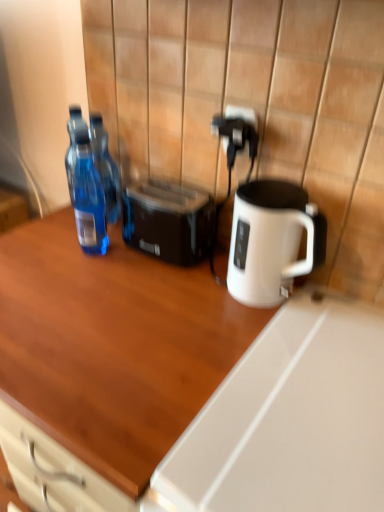
Describe the element at coordinates (179, 386) in the screenshot. I see `wooden desk at center` at that location.

The image size is (384, 512). In order to click on transparent plastic bottle at left, the second bottle positioned from the back in this screenshot , I will do `click(85, 187)`.

Is wooden desk at center oriented towards transparent plastic bottle at left, the 1th bottle positioned from the front?

No, wooden desk at center is not facing towards transparent plastic bottle at left, the 1th bottle positioned from the front.

From the image's perspective, would you say wooden desk at center is shown under transparent plastic bottle at left, the second bottle positioned from the back?

Indeed, from the image's perspective, wooden desk at center is shown beneath transparent plastic bottle at left, the second bottle positioned from the back.

Is wooden desk at center inside or outside of transparent plastic bottle at left, the second bottle positioned from the back?

wooden desk at center is located beyond the bounds of transparent plastic bottle at left, the second bottle positioned from the back.

Is point (150, 406) less distant than point (85, 212)?

Yes, point (150, 406) is closer to viewer.

Which of these two, transparent plastic bottle at left, the second bottle in the front-to-back sequence, or black plastic toaster at center, is wider?

black plastic toaster at center.

Can you confirm if transparent plastic bottle at left, which ranks as the first bottle in back-to-front order, is positioned to the right of black plastic toaster at center?

No.

Looking at this image, which object is closer to the camera, transparent plastic bottle at left, which ranks as the first bottle in back-to-front order, or black plastic toaster at center?

black plastic toaster at center.

How different are the orientations of black plastic electric outlet at upper right and transparent plastic bottle at left, which ranks as the first bottle in back-to-front order, in degrees?

black plastic electric outlet at upper right and transparent plastic bottle at left, which ranks as the first bottle in back-to-front order, are facing 2.45 degrees away from each other.

From a real-world perspective, is black plastic electric outlet at upper right positioned over transparent plastic bottle at left, the second bottle in the front-to-back sequence, based on gravity?

Yes, from a real-world perspective, black plastic electric outlet at upper right is over transparent plastic bottle at left, the second bottle in the front-to-back sequence

Considering the sizes of objects black plastic electric outlet at upper right and transparent plastic bottle at left, the second bottle in the front-to-back sequence, in the image provided, who is shorter, black plastic electric outlet at upper right or transparent plastic bottle at left, the second bottle in the front-to-back sequence,?

Standing shorter between the two is black plastic electric outlet at upper right.

Considering the points (229, 116) and (118, 173), which point is in front, point (229, 116) or point (118, 173)?

Positioned in front is point (229, 116).

Which of these two, wooden desk at center or black plastic electric outlet at upper right, is bigger?

wooden desk at center.

Would you say wooden desk at center is a long distance from black plastic electric outlet at upper right?

They are positioned close to each other.

Is black plastic electric outlet at upper right at the back of wooden desk at center?

No, wooden desk at center is not facing away from black plastic electric outlet at upper right.

Is black plastic toaster at center inside or outside of black plastic electric outlet at upper right?

black plastic toaster at center exists outside the volume of black plastic electric outlet at upper right.

Which is more to the right, black plastic toaster at center or black plastic electric outlet at upper right?

black plastic electric outlet at upper right is more to the right.

Is black plastic toaster at center shorter than black plastic electric outlet at upper right?

Incorrect, the height of black plastic toaster at center does not fall short of that of black plastic electric outlet at upper right.

Based on their sizes in the image, would you say black plastic toaster at center is bigger or smaller than black plastic electric outlet at upper right?

black plastic toaster at center is bigger than black plastic electric outlet at upper right.

Considering the relative sizes of transparent plastic bottle at left, the second bottle in the front-to-back sequence, and transparent plastic bottle at left, the 1th bottle positioned from the front, in the image provided, is transparent plastic bottle at left, the second bottle in the front-to-back sequence, taller than transparent plastic bottle at left, the 1th bottle positioned from the front,?

Incorrect, the height of transparent plastic bottle at left, the second bottle in the front-to-back sequence, is not larger of that of transparent plastic bottle at left, the 1th bottle positioned from the front.

Is transparent plastic bottle at left, the second bottle in the front-to-back sequence, closer to the viewer compared to transparent plastic bottle at left, the second bottle positioned from the back?

No, the depth of transparent plastic bottle at left, the second bottle in the front-to-back sequence, is greater than that of transparent plastic bottle at left, the second bottle positioned from the back.

Is transparent plastic bottle at left, the second bottle in the front-to-back sequence, situated inside transparent plastic bottle at left, the second bottle positioned from the back, or outside?

The correct answer is: outside.

This screenshot has width=384, height=512. In the image, there is a transparent plastic bottle at left, the second bottle positioned from the back. What are the coordinates of `bottle below it (from a real-world perspective)` in the screenshot? It's located at (105, 167).

From the image's perspective, which object appears higher, black plastic toaster at center or wooden desk at center?

black plastic toaster at center, from the image's perspective.

Is the depth of black plastic toaster at center greater than that of wooden desk at center?

Yes, black plastic toaster at center is further from the viewer.

Does black plastic toaster at center turn towards wooden desk at center?

No, black plastic toaster at center does not turn towards wooden desk at center.

Where is `desk below the transparent plastic bottle at left, the 1th bottle positioned from the front (from a real-world perspective)`? This screenshot has height=512, width=384. desk below the transparent plastic bottle at left, the 1th bottle positioned from the front (from a real-world perspective) is located at coordinates (179, 386).

The width and height of the screenshot is (384, 512). What are the coordinates of `toaster in front of the transparent plastic bottle at left, the second bottle in the front-to-back sequence` in the screenshot? It's located at (168, 220).

Estimate the real-world distances between objects in this image. Which object is further from transparent plastic bottle at left, the second bottle positioned from the back, black plastic toaster at center or transparent plastic bottle at left, which ranks as the first bottle in back-to-front order?

Based on the image, black plastic toaster at center appears to be further to transparent plastic bottle at left, the second bottle positioned from the back.

From the image, which object appears to be nearer to black plastic toaster at center, transparent plastic bottle at left, the 1th bottle positioned from the front, or black plastic electric outlet at upper right?

The object closer to black plastic toaster at center is transparent plastic bottle at left, the 1th bottle positioned from the front.

Consider the image. Based on their spatial positions, is transparent plastic bottle at left, the 1th bottle positioned from the front, or black plastic toaster at center further from wooden desk at center?

Based on the image, transparent plastic bottle at left, the 1th bottle positioned from the front, appears to be further to wooden desk at center.

When comparing their distances from black plastic toaster at center, does black plastic electric outlet at upper right or transparent plastic bottle at left, the second bottle positioned from the back, seem further?

black plastic electric outlet at upper right is positioned further to the anchor black plastic toaster at center.

From the image, which object appears to be farther from black plastic electric outlet at upper right, transparent plastic bottle at left, which ranks as the first bottle in back-to-front order, or black plastic toaster at center?

Among the two, transparent plastic bottle at left, which ranks as the first bottle in back-to-front order, is located further to black plastic electric outlet at upper right.

When comparing their distances from black plastic toaster at center, does transparent plastic bottle at left, which ranks as the first bottle in back-to-front order, or black plastic electric outlet at upper right seem closer?

transparent plastic bottle at left, which ranks as the first bottle in back-to-front order, is positioned closer to the anchor black plastic toaster at center.

Based on their spatial positions, is black plastic toaster at center or transparent plastic bottle at left, the second bottle positioned from the back, further from wooden desk at center?

Based on the image, transparent plastic bottle at left, the second bottle positioned from the back, appears to be further to wooden desk at center.

Looking at the image, which one is located closer to transparent plastic bottle at left, the second bottle positioned from the back, black plastic electric outlet at upper right or black plastic toaster at center?

black plastic toaster at center is positioned closer to the anchor transparent plastic bottle at left, the second bottle positioned from the back.

Where is `toaster between transparent plastic bottle at left, the 1th bottle positioned from the front, and wooden desk at center, in the vertical direction`? The width and height of the screenshot is (384, 512). toaster between transparent plastic bottle at left, the 1th bottle positioned from the front, and wooden desk at center, in the vertical direction is located at coordinates (168, 220).

You are a GUI agent. You are given a task and a screenshot of the screen. Output one action in this format:
    pyautogui.click(x=<x>, y=<y>)
    Task: Click on the toaster that lies between black plastic electric outlet at upper right and wooden desk at center from top to bottom
    
    Given the screenshot: What is the action you would take?
    pyautogui.click(x=168, y=220)

Where is `bottle situated between transparent plastic bottle at left, which ranks as the first bottle in back-to-front order, and black plastic toaster at center from left to right`? The height and width of the screenshot is (512, 384). bottle situated between transparent plastic bottle at left, which ranks as the first bottle in back-to-front order, and black plastic toaster at center from left to right is located at coordinates (85, 187).

The width and height of the screenshot is (384, 512). Identify the location of toaster situated between transparent plastic bottle at left, which ranks as the first bottle in back-to-front order, and black plastic electric outlet at upper right from left to right. (168, 220).